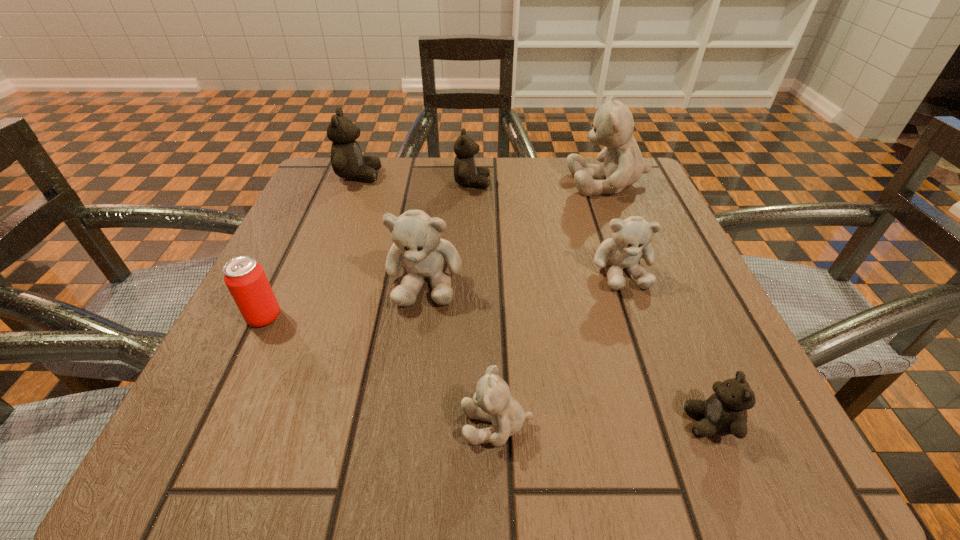
Find the location of a particular element. Image resolution: width=960 pixels, height=540 pixels. the nearest gray teddy bear is located at coordinates (492, 402).

The height and width of the screenshot is (540, 960). Find the location of `the smallest gray teddy bear`. the smallest gray teddy bear is located at coordinates (492, 402).

You are a GUI agent. You are given a task and a screenshot of the screen. Output one action in this format:
    pyautogui.click(x=<x>, y=<y>)
    Task: Click on the vacant space located 0.200m on the face of the tallest object
    The height and width of the screenshot is (540, 960).
    Given the screenshot: What is the action you would take?
    pyautogui.click(x=477, y=183)

At what (x,y) coordinates should I click in order to perform the action: click on vacant space located on the face of the tallest object. Please return your answer as a coordinate pair (x, y). Looking at the image, I should click on tap(396, 183).

The image size is (960, 540). I want to click on free space located 0.220m on the face of the tallest object, so click(468, 183).

I want to click on vacant area situated on the face of the biggest brown teddy bear, so click(x=460, y=176).

Where is `free space located on the face of the leftmost gray teddy bear`? free space located on the face of the leftmost gray teddy bear is located at coordinates (416, 349).

At what (x,y) coordinates should I click in order to perform the action: click on vacant region located 0.140m on the face of the second brown teddy bear from right to left. Please return your answer as a coordinate pair (x, y). Looking at the image, I should click on (553, 183).

In order to click on vacant space located 0.100m on the face of the second smallest gray teddy bear in this screenshot , I will do `click(647, 344)`.

Locate an element on the screen. The width and height of the screenshot is (960, 540). free space located on the back of the red beer can is located at coordinates (302, 236).